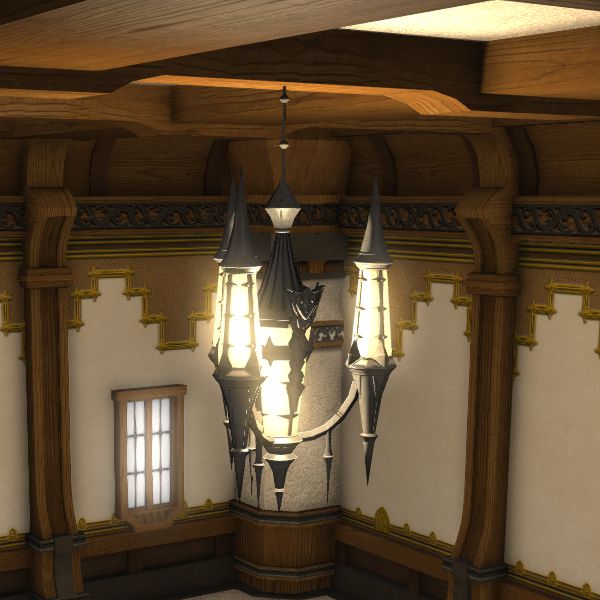
The image size is (600, 600). In order to click on window in this screenshot , I will do `click(141, 453)`.